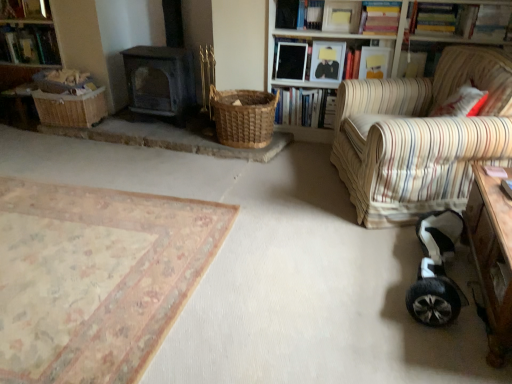
Question: Is striped fabric armchair at right outside wooden desk at lower right?

Choices:
 (A) yes
 (B) no

Answer: (A)

Question: From a real-world perspective, is striped fabric armchair at right physically above wooden desk at lower right?

Choices:
 (A) no
 (B) yes

Answer: (B)

Question: From the image's perspective, is striped fabric armchair at right above wooden desk at lower right?

Choices:
 (A) no
 (B) yes

Answer: (B)

Question: Is wooden desk at lower right a part of striped fabric armchair at right?

Choices:
 (A) yes
 (B) no

Answer: (B)

Question: Is striped fabric armchair at right bigger than wooden desk at lower right?

Choices:
 (A) no
 (B) yes

Answer: (B)

Question: Is striped fabric armchair at right facing away from wooden desk at lower right?

Choices:
 (A) no
 (B) yes

Answer: (A)

Question: Is wooden bookshelf at upper right located outside hardcover book at upper left, the first book in the left-to-right sequence?

Choices:
 (A) yes
 (B) no

Answer: (A)

Question: Does wooden bookshelf at upper right come in front of hardcover book at upper left, arranged as the 10th book when viewed from the right?

Choices:
 (A) no
 (B) yes

Answer: (B)

Question: From a real-world perspective, is wooden bookshelf at upper right positioned over hardcover book at upper left, the first book in the left-to-right sequence, based on gravity?

Choices:
 (A) yes
 (B) no

Answer: (B)

Question: From a real-world perspective, is wooden bookshelf at upper right under hardcover book at upper left, the first book in the left-to-right sequence?

Choices:
 (A) no
 (B) yes

Answer: (B)

Question: Considering the relative sizes of wooden bookshelf at upper right and hardcover book at upper left, arranged as the 10th book when viewed from the right, in the image provided, is wooden bookshelf at upper right shorter than hardcover book at upper left, arranged as the 10th book when viewed from the right,?

Choices:
 (A) no
 (B) yes

Answer: (A)

Question: Is wooden bookshelf at upper right turned away from hardcover book at upper left, arranged as the 10th book when viewed from the right?

Choices:
 (A) yes
 (B) no

Answer: (B)

Question: From a real-world perspective, is wooden bookshelf at upper right below woven brown basket at center, placed as the first basket when sorted from right to left?

Choices:
 (A) no
 (B) yes

Answer: (A)